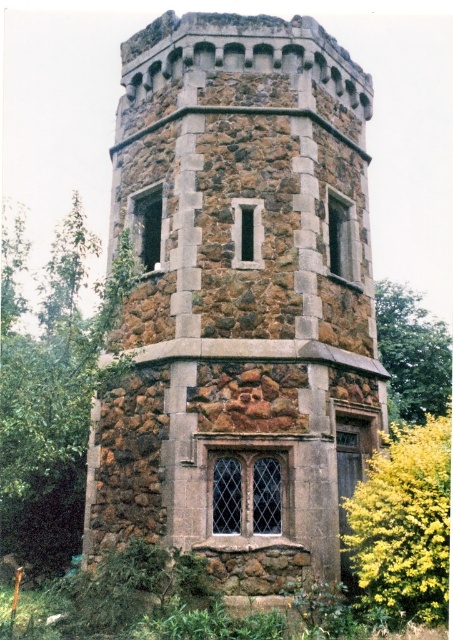
You are standing at the center of the image looking towards the stone tower. Which direction should you turn to face the green leafy tree at left?

You should turn to your left to face the green leafy tree at left since it is located at the left side of the image.

You are standing in front of the stone tower and notice a yellow leafy bush at lower right and a green leafy tree at right. Which of these two plants is positioned more to the left side?

The yellow leafy bush at lower right is positioned to the left of the green leafy tree at right, so the yellow leafy bush at lower right is more to the left.